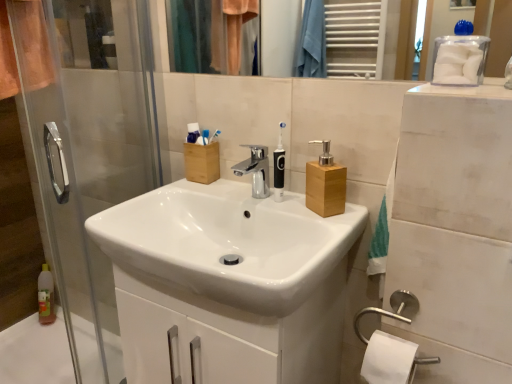
This screenshot has width=512, height=384. Identify the location of wooden soap dispenser at center. (325, 184).

Describe the element at coordinates (228, 242) in the screenshot. I see `white glossy sink at center` at that location.

Describe the element at coordinates (193, 132) in the screenshot. I see `matte plastic toothbrushes at upper center` at that location.

Measure the distance between matte plastic toothbrushes at upper center and camera.

4.19 feet.

Locate an element on the screen. This screenshot has width=512, height=384. black plastic toothbrush at upper center, positioned as the second toothbrush in left-to-right order is located at coordinates (214, 136).

Which is behind, white plastic toothbrush at upper center, the 1th toothbrush positioned from the left, or black plastic toothbrush at center, which appears as the 1th toothbrush when viewed from the right?

white plastic toothbrush at upper center, the 1th toothbrush positioned from the left, is more distant.

Find the location of a particular element. The image size is (512, 384). the 2nd toothbrush counting from the right of the white plastic toothbrush at upper center, placed as the 3th toothbrush when sorted from right to left is located at coordinates [279, 167].

From the image's perspective, is white plastic toothbrush at upper center, placed as the 3th toothbrush when sorted from right to left, over black plastic toothbrush at center, which appears as the 1th toothbrush when viewed from the right?

Yes, from the image's perspective, white plastic toothbrush at upper center, placed as the 3th toothbrush when sorted from right to left, is over black plastic toothbrush at center, which appears as the 1th toothbrush when viewed from the right.

Which is in front, point (207, 130) or point (279, 186)?

The point (279, 186) is more forward.

Does point (281, 150) lie behind point (12, 379)?

No, it is not.

From a real-world perspective, is black plastic toothbrush at center, which appears as the 1th toothbrush when viewed from the right, over clear plastic bottle at lower left?

Yes.

How many degrees apart are the facing directions of black plastic toothbrush at center, the third toothbrush viewed from the back, and clear plastic bottle at lower left?

The angular difference between black plastic toothbrush at center, the third toothbrush viewed from the back, and clear plastic bottle at lower left is 84.4 degrees.

How much distance is there between satin nickel towel bar at lower right and wooden soap dispenser at center?

satin nickel towel bar at lower right is 12.62 inches away from wooden soap dispenser at center.

In terms of width, does satin nickel towel bar at lower right look wider or thinner when compared to wooden soap dispenser at center?

In the image, satin nickel towel bar at lower right appears to be more narrow than wooden soap dispenser at center.

At what (x,y) coordinates should I click in order to perform the action: click on soap dispenser on the left of satin nickel towel bar at lower right. Please return your answer as a coordinate pair (x, y). This screenshot has height=384, width=512. Looking at the image, I should click on (325, 184).

Do you think satin nickel towel bar at lower right is within wooden soap dispenser at center, or outside of it?

satin nickel towel bar at lower right is spatially situated outside wooden soap dispenser at center.

From the image's perspective, is black plastic toothbrush at center, positioned as the first toothbrush in front-to-back order, located above white plastic toothbrush at upper center, which appears as the 2th toothbrush when viewed from the back?

No, from the image's perspective, black plastic toothbrush at center, positioned as the first toothbrush in front-to-back order, is not above white plastic toothbrush at upper center, which appears as the 2th toothbrush when viewed from the back.

From the picture: How different are the orientations of black plastic toothbrush at center, the third toothbrush viewed from the left, and white plastic toothbrush at upper center, placed as the 3th toothbrush when sorted from right to left, in degrees?

There is a 37.9-degree angle between the facing directions of black plastic toothbrush at center, the third toothbrush viewed from the left, and white plastic toothbrush at upper center, placed as the 3th toothbrush when sorted from right to left.

Is black plastic toothbrush at center, which appears as the 1th toothbrush when viewed from the right, oriented towards white plastic toothbrush at upper center, placed as the 3th toothbrush when sorted from right to left?

No.

Considering the relative sizes of black plastic toothbrush at center, the third toothbrush viewed from the left, and white plastic toothbrush at upper center, which appears as the 2th toothbrush when viewed from the back, in the image provided, is black plastic toothbrush at center, the third toothbrush viewed from the left, thinner than white plastic toothbrush at upper center, which appears as the 2th toothbrush when viewed from the back,?

No.

From a real-world perspective, is white glossy sink at center above or below satin nickel towel bar at lower right?

white glossy sink at center is above satin nickel towel bar at lower right.

Considering their positions, is white glossy sink at center located in front of or behind satin nickel towel bar at lower right?

Visually, white glossy sink at center is located in front of satin nickel towel bar at lower right.

At what (x,y) coordinates should I click in order to perform the action: click on sink in front of the satin nickel towel bar at lower right. Please return your answer as a coordinate pair (x, y). This screenshot has height=384, width=512. Looking at the image, I should click on (228, 242).

Is there a large distance between white glossy sink at center and satin nickel towel bar at lower right?

No, white glossy sink at center is in close proximity to satin nickel towel bar at lower right.

Considering the points (285, 123) and (328, 206), which point is in front, point (285, 123) or point (328, 206)?

The point (328, 206) is closer.

Is black plastic toothbrush at center, the third toothbrush viewed from the back, positioned with its back to wooden soap dispenser at center?

black plastic toothbrush at center, the third toothbrush viewed from the back, is not turned away from wooden soap dispenser at center.

From a real-world perspective, is black plastic toothbrush at center, positioned as the first toothbrush in front-to-back order, beneath wooden soap dispenser at center?

No, from a real-world perspective, black plastic toothbrush at center, positioned as the first toothbrush in front-to-back order, is not beneath wooden soap dispenser at center.

Is wooden soap dispenser at center surrounded by black plastic toothbrush at center, which appears as the 1th toothbrush when viewed from the right?

No.

Is matte plastic toothbrushes at upper center taller than clear plastic bottle at lower left?

No.

Looking at the image, does matte plastic toothbrushes at upper center seem bigger or smaller compared to clear plastic bottle at lower left?

matte plastic toothbrushes at upper center is smaller than clear plastic bottle at lower left.

Does point (199, 136) appear closer or farther from the camera than point (57, 350)?

Point (199, 136).

Starting from the black plastic toothbrush at center, which appears as the 1th toothbrush when viewed from the right, which toothbrush is the 1st one behind? Please provide its 2D coordinates.

[(205, 136)]

I want to click on bath below the black plastic toothbrush at center, the third toothbrush viewed from the back (from a real-world perspective), so click(x=36, y=352).

Estimate the real-world distances between objects in this image. Which object is further from transparent glass screen door at left, white plastic toothbrush at upper center, which appears as the 2th toothbrush when viewed from the back, or satin nickel towel bar at lower right?

Based on the image, satin nickel towel bar at lower right appears to be further to transparent glass screen door at left.

Which object lies nearer to the anchor point matte plastic toothbrushes at upper center, black plastic toothbrush at center, the third toothbrush viewed from the left, or wooden soap dispenser at center?

The object closer to matte plastic toothbrushes at upper center is black plastic toothbrush at center, the third toothbrush viewed from the left.

Looking at the image, which one is located closer to white glossy sink at center, satin nickel towel bar at lower right or wooden soap dispenser at center?

Among the two, wooden soap dispenser at center is located nearer to white glossy sink at center.

From the image, which object appears to be nearer to black plastic toothbrush at upper center, marked as the 3th toothbrush in a front-to-back arrangement, white plastic toothbrush at upper center, the second toothbrush viewed from the front, or transparent glass screen door at left?

Based on the image, white plastic toothbrush at upper center, the second toothbrush viewed from the front, appears to be nearer to black plastic toothbrush at upper center, marked as the 3th toothbrush in a front-to-back arrangement.

Estimate the real-world distances between objects in this image. Which object is further from wooden soap dispenser at center, clear plastic bottle at lower left or matte plastic toothbrushes at upper center?

clear plastic bottle at lower left is positioned further to the anchor wooden soap dispenser at center.

Considering their positions, is matte plastic toothbrushes at upper center positioned closer to white glossy sink at center than transparent glass screen door at left?

Among the two, matte plastic toothbrushes at upper center is located nearer to white glossy sink at center.

When comparing their distances from white plastic toothbrush at upper center, placed as the 3th toothbrush when sorted from right to left, does black plastic toothbrush at center, which appears as the 1th toothbrush when viewed from the right, or matte plastic toothbrushes at upper center seem further?

black plastic toothbrush at center, which appears as the 1th toothbrush when viewed from the right, is further to white plastic toothbrush at upper center, placed as the 3th toothbrush when sorted from right to left.

Looking at the image, which one is located further to matte plastic toothbrushes at upper center, black plastic toothbrush at center, which appears as the 1th toothbrush when viewed from the right, or white plastic toothbrush at upper center, which appears as the 2th toothbrush when viewed from the back?

Based on the image, black plastic toothbrush at center, which appears as the 1th toothbrush when viewed from the right, appears to be further to matte plastic toothbrushes at upper center.

Find the location of a particular element. This screenshot has width=512, height=384. soap dispenser between white glossy sink at center and black plastic toothbrush at center, which appears as the 1th toothbrush when viewed from the right, along the z-axis is located at coordinates (325, 184).

Locate an element on the screen. soap dispenser between white glossy sink at center and satin nickel towel bar at lower right in the horizontal direction is located at coordinates pos(325,184).

Locate an element on the screen. The width and height of the screenshot is (512, 384). toothbrush between white glossy sink at center and white plastic toothbrush at upper center, the 1th toothbrush positioned from the left, in the front-back direction is located at coordinates (279, 167).

At what (x,y) coordinates should I click in order to perform the action: click on toothbrush located between white plastic toothbrush at upper center, the second toothbrush viewed from the front, and black plastic toothbrush at center, the third toothbrush viewed from the left, in the left-right direction. Please return your answer as a coordinate pair (x, y). Looking at the image, I should click on (214, 136).